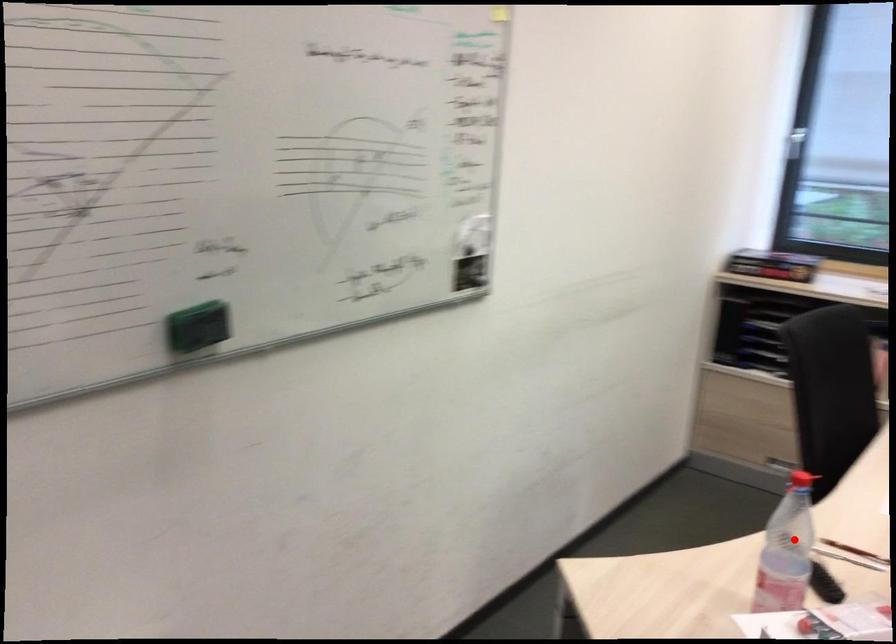
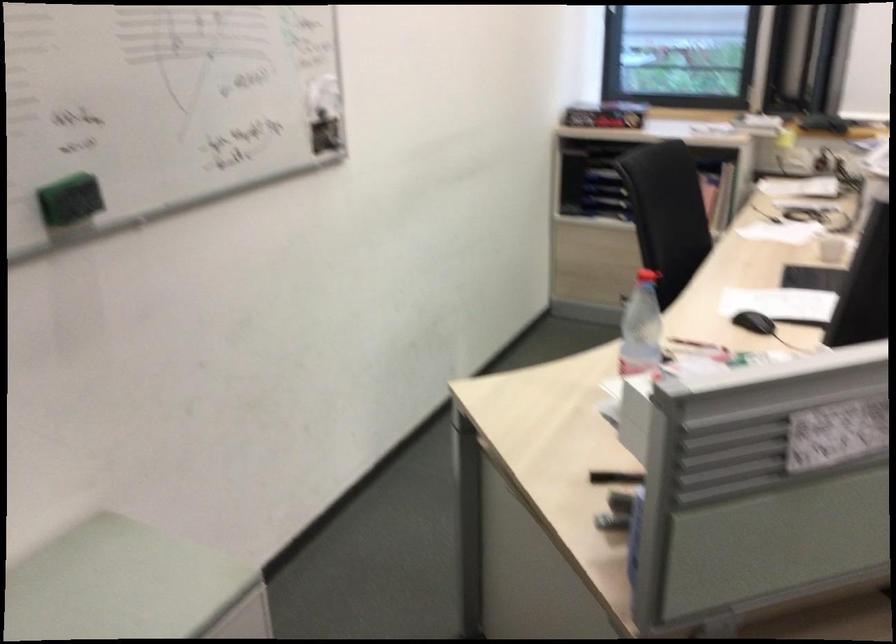
Question: I am providing you with two images of the same scene from different viewpoints. Given a red point in image1, look at the same physical point in image2. Is it:

Choices:
 (A) Closer to the viewpoint
 (B) Farther from the viewpoint

Answer: (B)